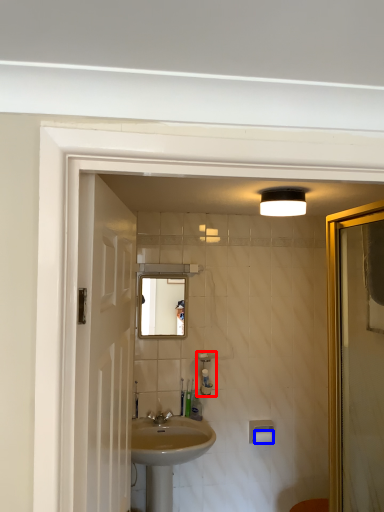
Question: Which of the following is the farthest to the observer, soap dispenser (highlighted by a red box) or toilet paper (highlighted by a blue box)?

Choices:
 (A) soap dispenser
 (B) toilet paper

Answer: (B)